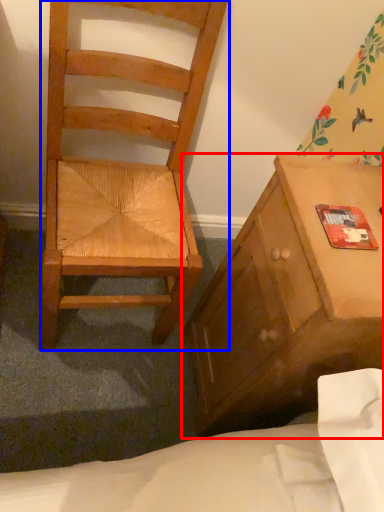
Question: Which object appears closest to the camera in this image, cabinetry (highlighted by a red box) or chair (highlighted by a blue box)?

Choices:
 (A) cabinetry
 (B) chair

Answer: (B)